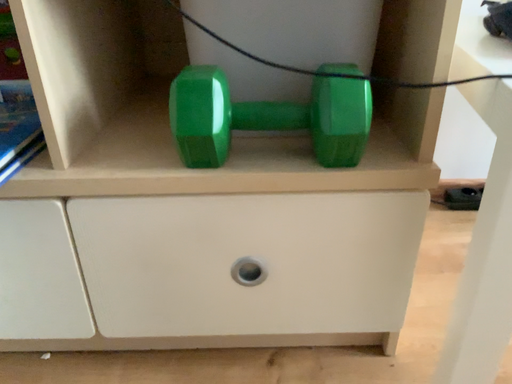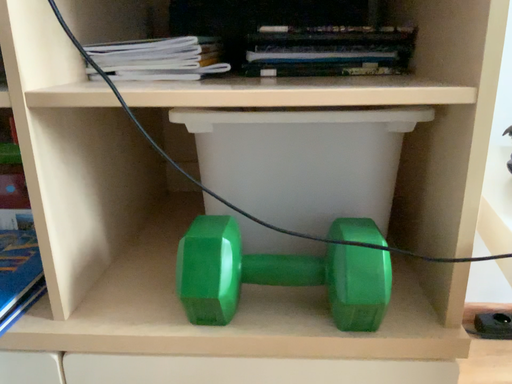
Question: Which way did the camera rotate in the video?

Choices:
 (A) rotated downward
 (B) rotated upward

Answer: (B)